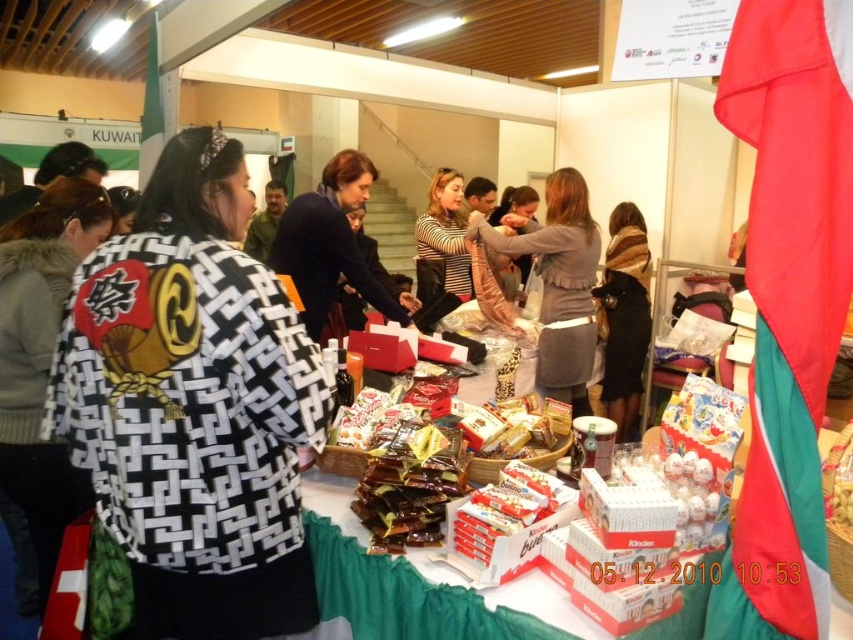
Consider the image. You are a vendor at the market and want to place a new item between the black and white patterned kimono at center and the brown wool scarf at center. Based on their positions, where should you place the new item?

The black and white patterned kimono at center is below the brown wool scarf at center, so placing the new item between them would require positioning it above the kimono and below the scarf.

You are a vendor at the market and want to display the leather jacket at center and the brown wool scarf at center on the table. Which item requires more horizontal space to display properly?

The leather jacket at center requires more horizontal space to display properly since its width is larger than that of the brown wool scarf at center.